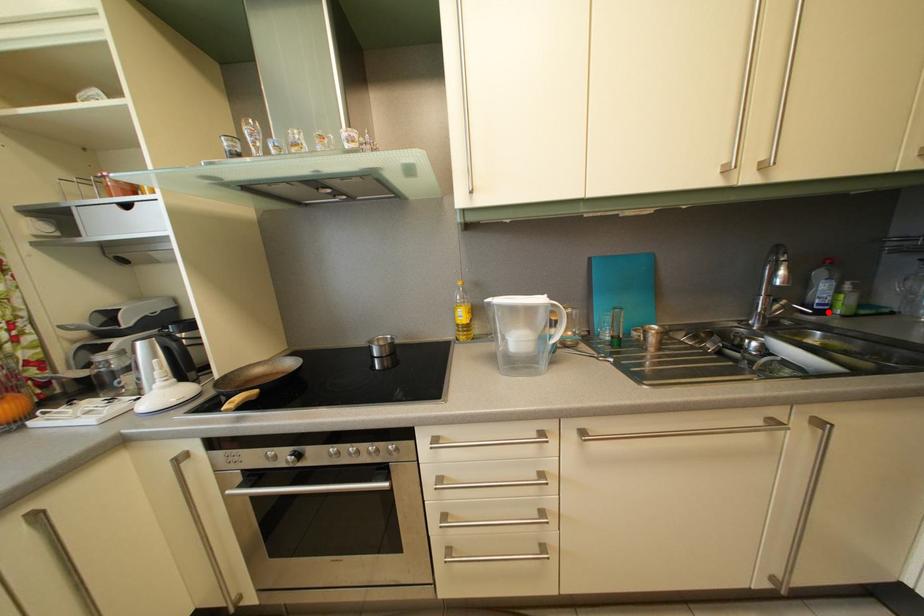
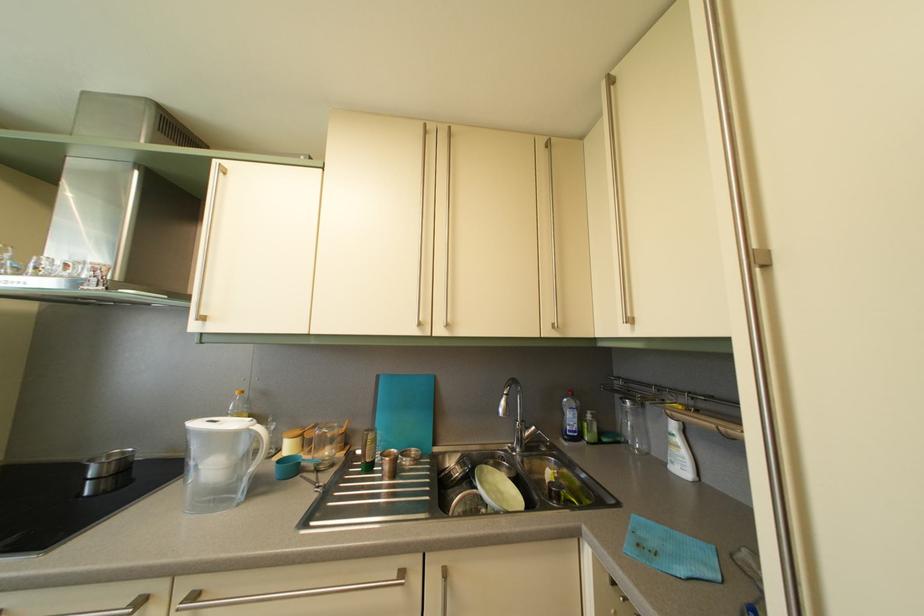
Question: A red point is marked in image1. In image2, is the corresponding 3D point closer to the camera or farther? Reply with the corresponding letter.

Choices:
 (A) The corresponding 3D point is closer.
 (B) The corresponding 3D point is farther.

Answer: (B)